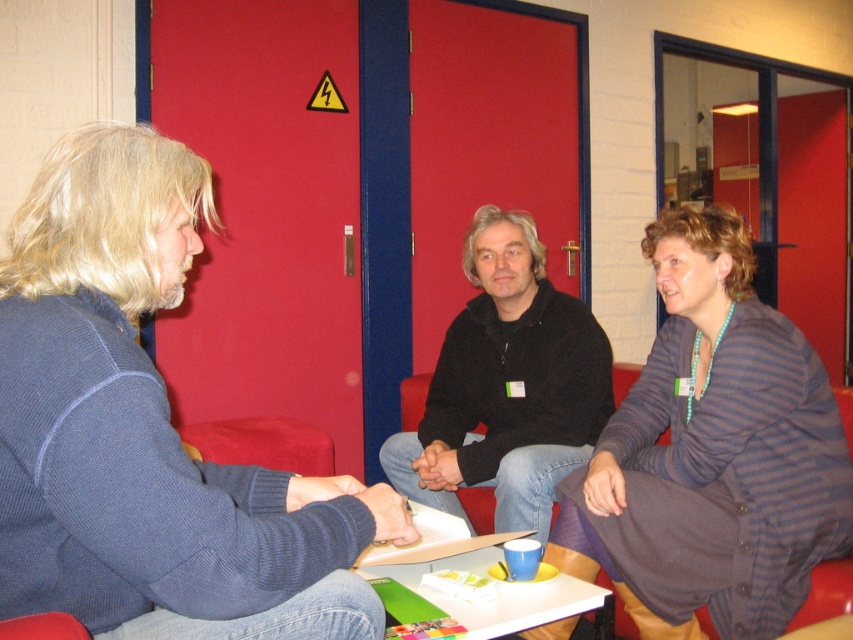
Who is more forward, (167,148) or (527,595)?

Point (167,148)

Does blue fabric sweater at left have a lesser width compared to white glossy table at center?

No.

What do you see at coordinates (138, 419) in the screenshot?
I see `blue fabric sweater at left` at bounding box center [138, 419].

Where is `blue fabric sweater at left`? blue fabric sweater at left is located at coordinates (138, 419).

Between blue fabric sweater at left and striped knit cardigan at center, which one has less height?

blue fabric sweater at left

From the picture: Is blue fabric sweater at left behind striped knit cardigan at center?

No, it is not.

This screenshot has height=640, width=853. Describe the element at coordinates (138, 419) in the screenshot. I see `blue fabric sweater at left` at that location.

Where is `blue fabric sweater at left`? The image size is (853, 640). blue fabric sweater at left is located at coordinates (138, 419).

Does point (776, 548) come behind point (453, 600)?

Yes, point (776, 548) is farther from viewer.

You are a GUI agent. You are given a task and a screenshot of the screen. Output one action in this format:
    pyautogui.click(x=<x>, y=<y>)
    Task: Click on the striped knit cardigan at center
    
    Given the screenshot: What is the action you would take?
    pyautogui.click(x=712, y=452)

This screenshot has height=640, width=853. What are the coordinates of `striped knit cardigan at center` in the screenshot? It's located at (712, 452).